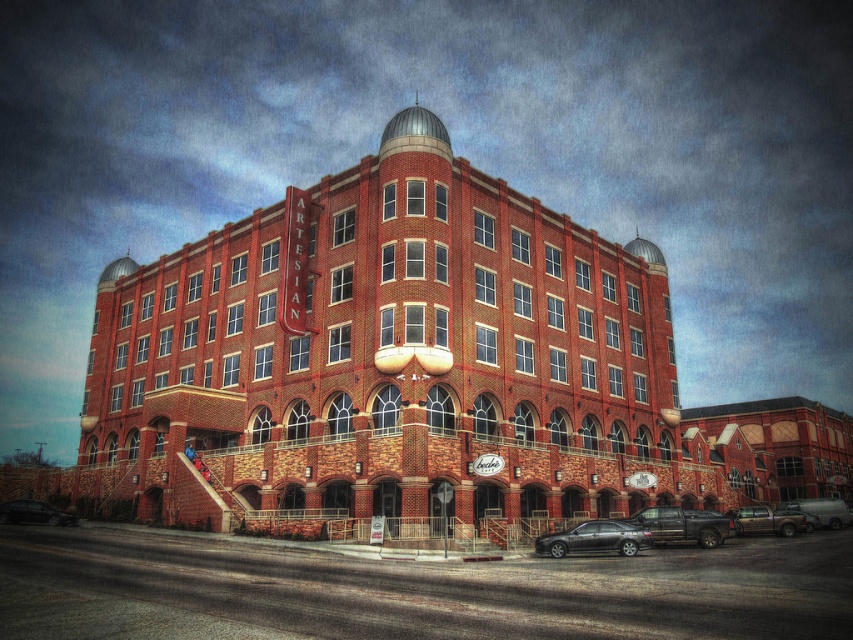
Question: Is metallic silver pickup truck at center to the left of shiny black sedan at lower left from the viewer's perspective?

Choices:
 (A) no
 (B) yes

Answer: (A)

Question: Observing the image, what is the correct spatial positioning of metallic silver pickup truck at center in reference to shiny black sedan at lower left?

Choices:
 (A) left
 (B) right

Answer: (B)

Question: Among these objects, which one is farthest from the camera?

Choices:
 (A) brick building at lower right
 (B) shiny black sedan at lower center
 (C) shiny black sedan at lower left
 (D) metallic silver pickup truck at center

Answer: (A)

Question: Among these objects, which one is farthest from the camera?

Choices:
 (A) red brick building at center
 (B) shiny black sedan at lower left
 (C) metallic silver truck at lower right
 (D) metallic silver pickup truck at center

Answer: (C)

Question: Which is farther from the shiny black sedan at lower center?

Choices:
 (A) metallic silver pickup truck at center
 (B) brown matte truck at lower right
 (C) brick building at lower right
 (D) shiny black sedan at lower left

Answer: (C)

Question: In this image, where is shiny black sedan at lower left located relative to metallic silver truck at lower right?

Choices:
 (A) right
 (B) left

Answer: (B)